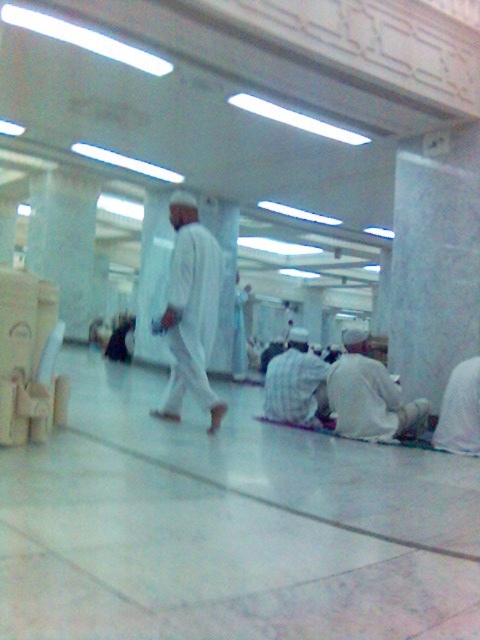
Question: Which of the following is the farthest from the observer?

Choices:
 (A) (177, 269)
 (B) (443, 426)
 (C) (358, 378)
 (D) (294, 355)

Answer: (D)

Question: Among these points, which one is nearest to the camera?

Choices:
 (A) (396, 394)
 (B) (288, 410)
 (C) (206, 328)

Answer: (C)

Question: Is white matte cloth at lower right above checkered fabric robe at center?

Choices:
 (A) yes
 (B) no

Answer: (A)

Question: Can you confirm if white matte cloth at lower right is positioned to the right of checkered fabric robe at center?

Choices:
 (A) no
 (B) yes

Answer: (B)

Question: Does white matte clothing at center lie behind white matte robe at lower right?

Choices:
 (A) yes
 (B) no

Answer: (B)

Question: Which object is positioned closest to the white matte cloth at lower right?

Choices:
 (A) checkered fabric robe at center
 (B) white matte clothing at center

Answer: (A)